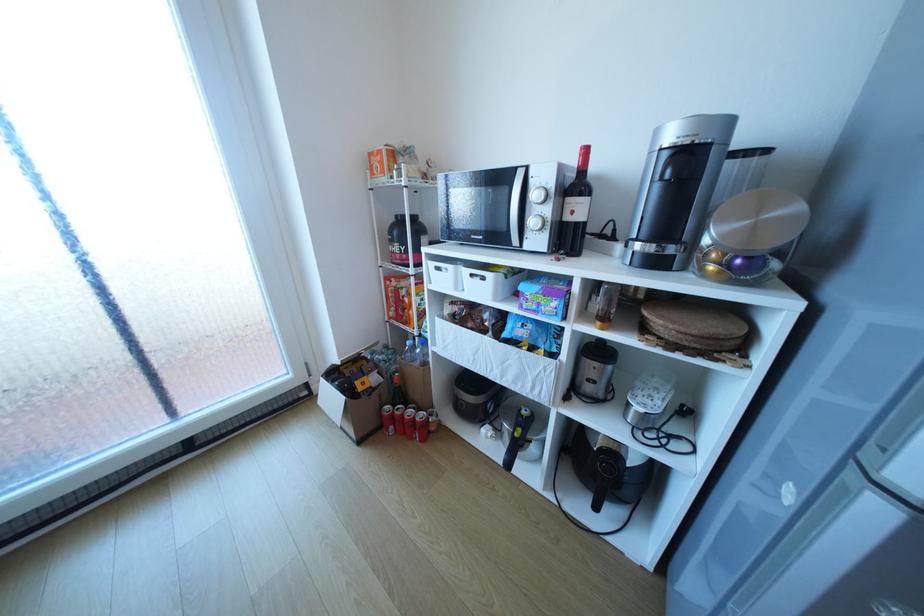
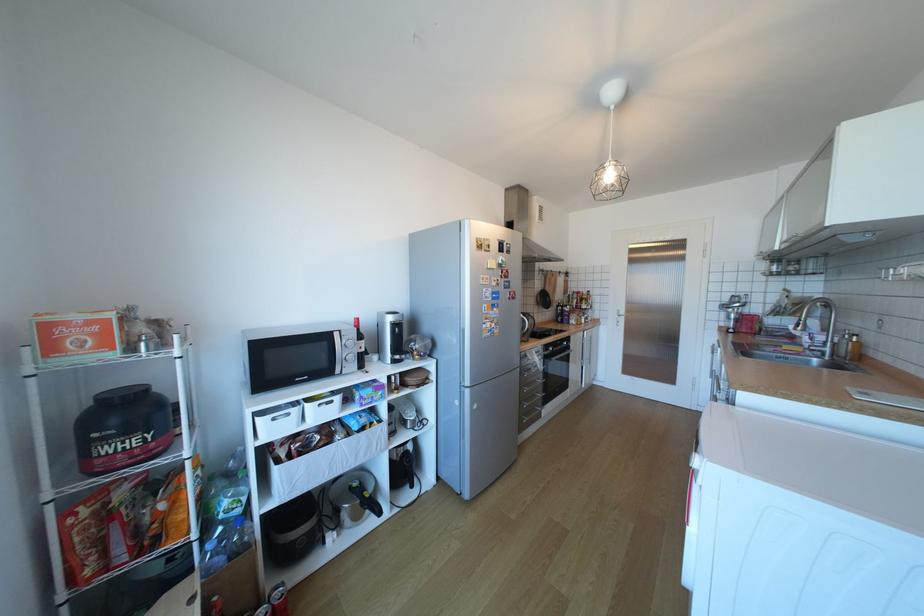
Locate, in the second image, the point that corresponds to (409,249) in the first image.

(152, 439)